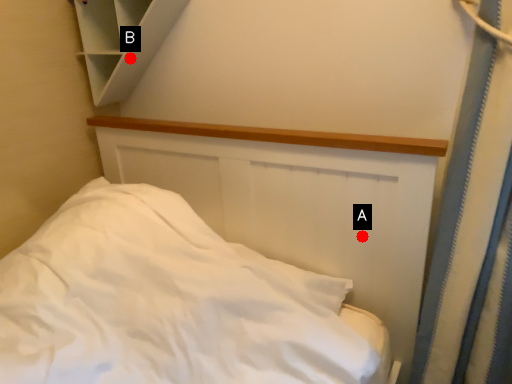
Question: Two points are circled on the image, labeled by A and B beside each circle. Which point is closer to the camera taking this photo?

Choices:
 (A) A is closer
 (B) B is closer

Answer: (A)